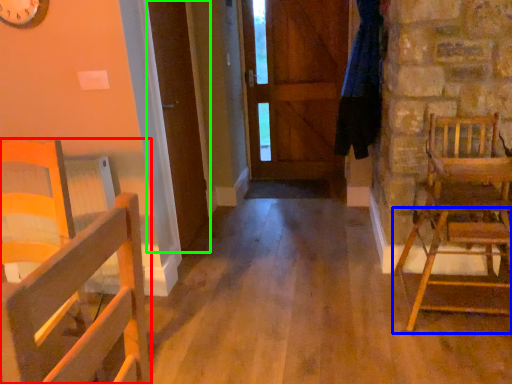
Question: Which object is the closest to the chair (highlighted by a red box)? Choose among these: chair (highlighted by a blue box) or door (highlighted by a green box).

Choices:
 (A) chair
 (B) door

Answer: (B)